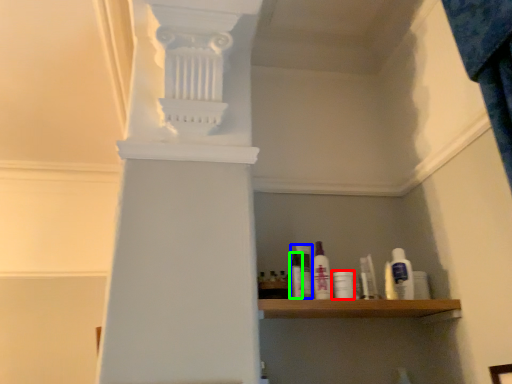
Question: Which object is the closest to the toiletry (highlighted by a red box)? Choose among these: mouthwash (highlighted by a blue box) or toiletry (highlighted by a green box).

Choices:
 (A) mouthwash
 (B) toiletry

Answer: (A)